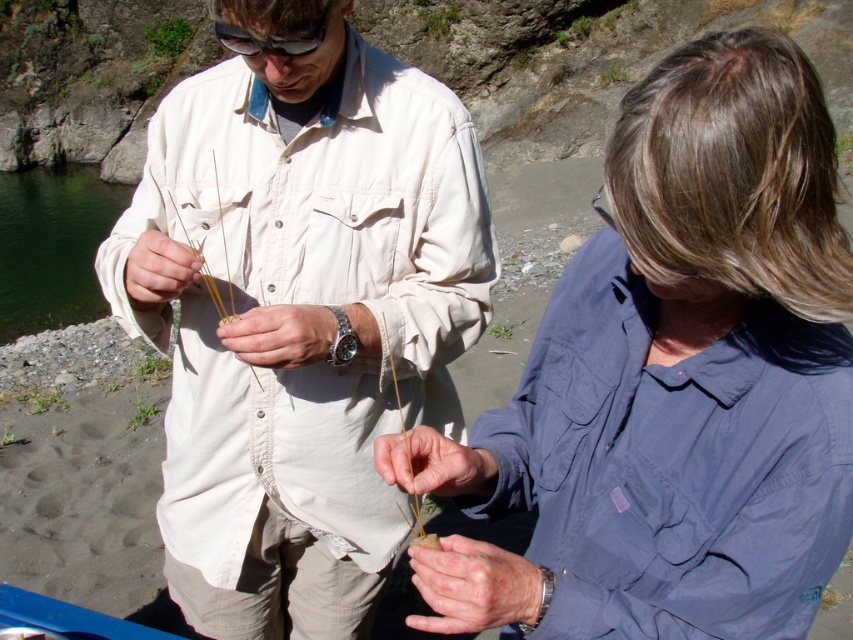
Between blue fabric shirt at center and matte beige stick at center, which one has less height?

Standing shorter between the two is matte beige stick at center.

Does point (709, 556) lie in front of point (146, 272)?

Yes.

Which is behind, point (843, 353) or point (160, 282)?

Positioned behind is point (160, 282).

Locate an element on the screen. blue fabric shirt at center is located at coordinates (692, 365).

Image resolution: width=853 pixels, height=640 pixels. I want to click on blue fabric shirt at center, so click(x=692, y=365).

Does blue fabric shirt at center have a greater height compared to matte brown stick at center?

Yes.

Who is more forward, (694,42) or (268,365)?

Point (694,42)

Locate an element on the screen. blue fabric shirt at center is located at coordinates (692, 365).

Is dry skin at center positioned at the back of matte black goggles at upper center?

No, dry skin at center is in front of matte black goggles at upper center.

Is point (524, 557) farther from camera compared to point (241, 36)?

No, it is not.

Find the location of `dry skin at center`. dry skin at center is located at coordinates (473, 586).